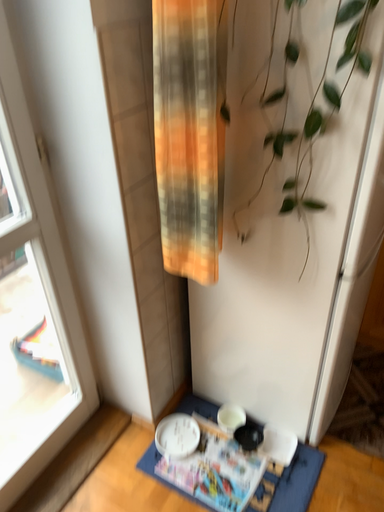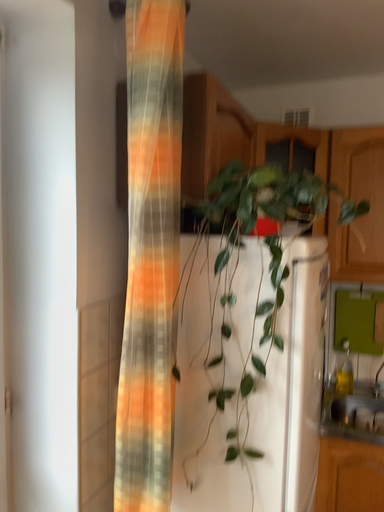
Question: How did the camera likely rotate when shooting the video?

Choices:
 (A) rotated right
 (B) rotated left

Answer: (A)